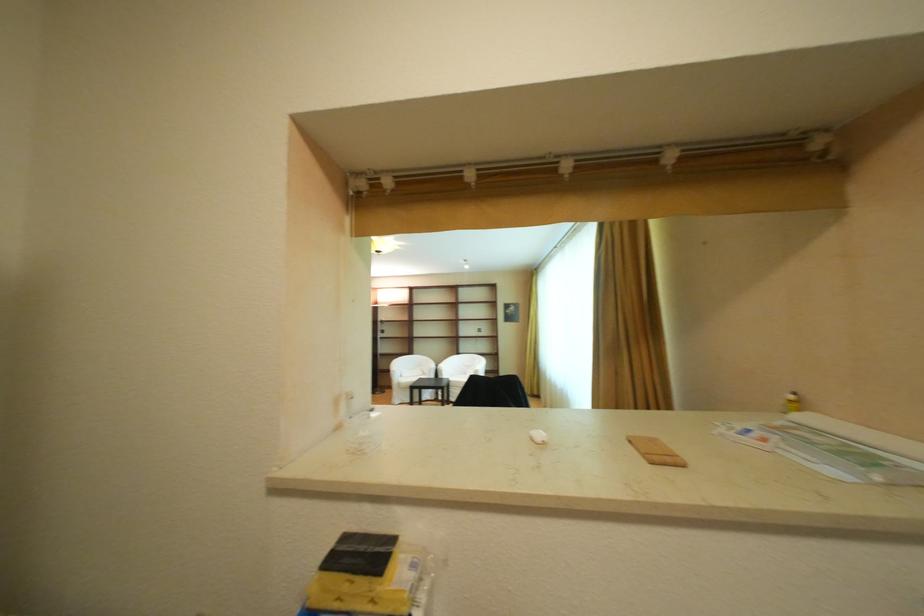
The location [655,451] corresponds to which object?

It corresponds to the small wooden block in the image.